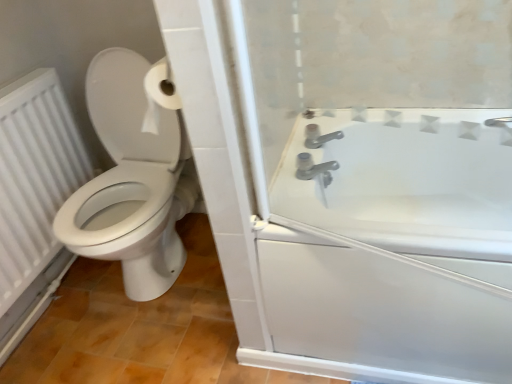
Question: From the image's perspective, is white glossy bathtub at right on top of white textured radiator at left?

Choices:
 (A) yes
 (B) no

Answer: (B)

Question: Does white glossy bathtub at right have a smaller size compared to white textured radiator at left?

Choices:
 (A) no
 (B) yes

Answer: (A)

Question: From a real-world perspective, is white glossy bathtub at right located beneath white textured radiator at left?

Choices:
 (A) yes
 (B) no

Answer: (A)

Question: Is white glossy bathtub at right directly adjacent to white textured radiator at left?

Choices:
 (A) yes
 (B) no

Answer: (B)

Question: Considering the relative positions of white glossy bathtub at right and white textured radiator at left in the image provided, is white glossy bathtub at right to the left of white textured radiator at left from the viewer's perspective?

Choices:
 (A) no
 (B) yes

Answer: (A)

Question: Considering the relative positions of white glossy bathtub at right and white textured radiator at left in the image provided, is white glossy bathtub at right to the right of white textured radiator at left from the viewer's perspective?

Choices:
 (A) yes
 (B) no

Answer: (A)

Question: Is satin nickel faucet at upper right looking in the opposite direction of white glossy bathtub at right?

Choices:
 (A) no
 (B) yes

Answer: (A)

Question: Would you say satin nickel faucet at upper right is a long distance from white glossy bathtub at right?

Choices:
 (A) no
 (B) yes

Answer: (A)

Question: Is satin nickel faucet at upper right outside white glossy bathtub at right?

Choices:
 (A) no
 (B) yes

Answer: (B)

Question: Is the depth of satin nickel faucet at upper right greater than that of white glossy bathtub at right?

Choices:
 (A) no
 (B) yes

Answer: (B)

Question: From a real-world perspective, is satin nickel faucet at upper right beneath white glossy bathtub at right?

Choices:
 (A) no
 (B) yes

Answer: (A)

Question: From the image's perspective, is satin nickel faucet at upper right on white glossy bathtub at right?

Choices:
 (A) yes
 (B) no

Answer: (A)

Question: Would you say white textured radiator at left is a long distance from satin nickel faucet at upper right?

Choices:
 (A) no
 (B) yes

Answer: (A)